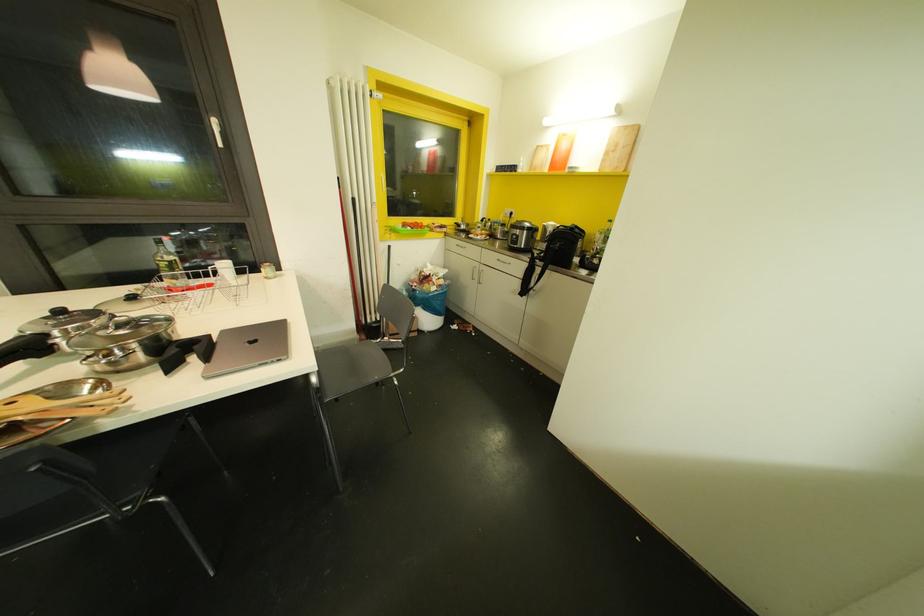
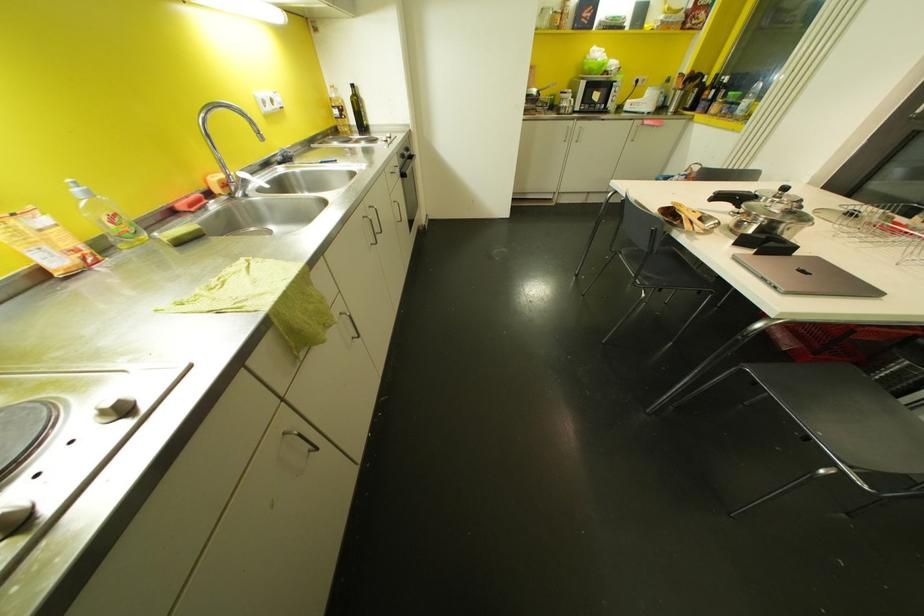
The point at (x=393, y=371) is marked in the first image. Where is the corresponding point in the second image?

(852, 467)